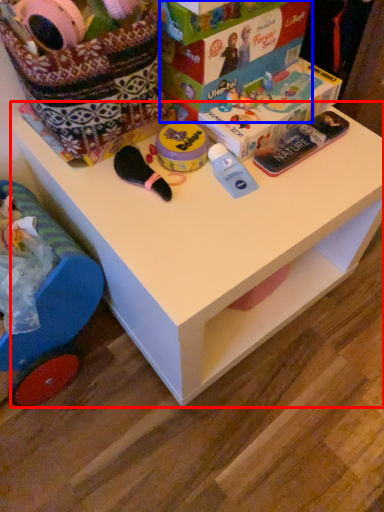
Question: Which object is further to the camera taking this photo, table (highlighted by a red box) or storage box (highlighted by a blue box)?

Choices:
 (A) table
 (B) storage box

Answer: (B)